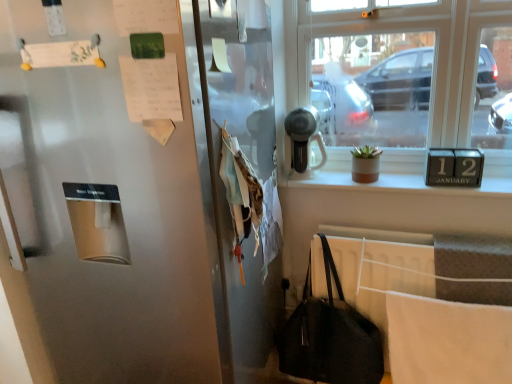
Question: Is satin silver refrigerator at left oriented towards white paper at upper left, marked as the first paper in a bottom-to-top arrangement?

Choices:
 (A) no
 (B) yes

Answer: (B)

Question: Is satin silver refrigerator at left positioned behind white paper at upper left, which is the second paper from left to right?

Choices:
 (A) no
 (B) yes

Answer: (A)

Question: From the image's perspective, would you say satin silver refrigerator at left is shown under white paper at upper left, marked as the first paper in a bottom-to-top arrangement?

Choices:
 (A) yes
 (B) no

Answer: (A)

Question: Can you confirm if satin silver refrigerator at left is smaller than white paper at upper left, which is the second paper from left to right?

Choices:
 (A) yes
 (B) no

Answer: (B)

Question: Does satin silver refrigerator at left appear on the left side of white paper at upper left, acting as the 2th paper starting from the top?

Choices:
 (A) yes
 (B) no

Answer: (A)

Question: Is white paper at upper left, marked as the first paper in a bottom-to-top arrangement, situated inside black leather handbag at lower right or outside?

Choices:
 (A) inside
 (B) outside

Answer: (B)

Question: From the image's perspective, relative to black leather handbag at lower right, is white paper at upper left, which is the first paper in right-to-left order, above or below?

Choices:
 (A) above
 (B) below

Answer: (A)

Question: From their relative heights in the image, would you say white paper at upper left, marked as the first paper in a bottom-to-top arrangement, is taller or shorter than black leather handbag at lower right?

Choices:
 (A) tall
 (B) short

Answer: (B)

Question: Does point (158, 96) appear closer or farther from the camera than point (310, 379)?

Choices:
 (A) closer
 (B) farther

Answer: (A)

Question: Is point (287, 54) closer or farther from the camera than point (168, 66)?

Choices:
 (A) closer
 (B) farther

Answer: (B)

Question: From the image's perspective, is clear glass window at upper right located above or below white paper at upper left, which is the second paper from left to right?

Choices:
 (A) below
 (B) above

Answer: (B)

Question: Considering the positions of clear glass window at upper right and white paper at upper left, acting as the 2th paper starting from the top, in the image, is clear glass window at upper right taller or shorter than white paper at upper left, acting as the 2th paper starting from the top,?

Choices:
 (A) tall
 (B) short

Answer: (A)

Question: Is clear glass window at upper right spatially inside white paper at upper left, which is the second paper from left to right, or outside of it?

Choices:
 (A) inside
 (B) outside

Answer: (B)

Question: From their relative heights in the image, would you say satin silver hairdryer at upper center is taller or shorter than black leather handbag at lower right?

Choices:
 (A) tall
 (B) short

Answer: (B)

Question: From the image's perspective, is satin silver hairdryer at upper center above or below black leather handbag at lower right?

Choices:
 (A) above
 (B) below

Answer: (A)